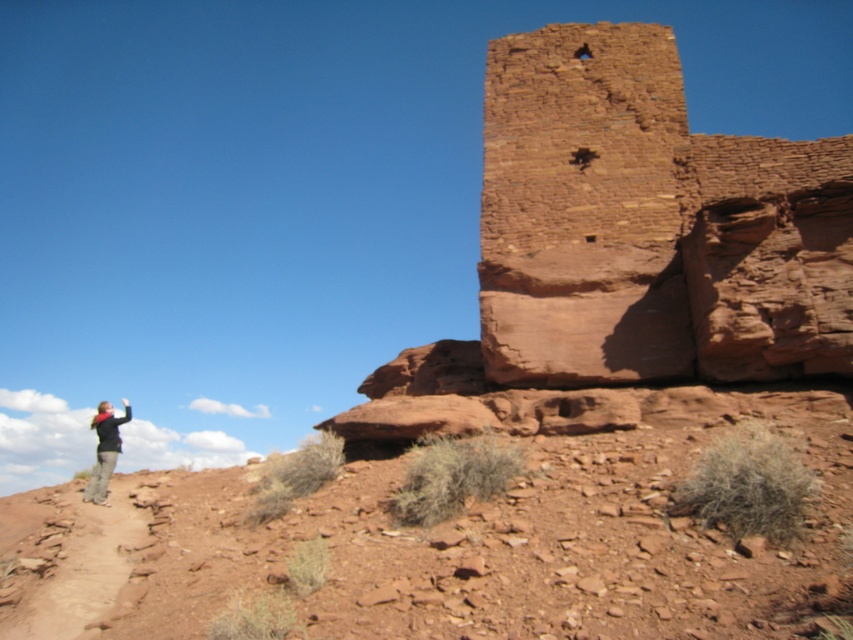
Can you confirm if reddish-brown rock at lower left is positioned below rustic stone ruins at upper right?

Yes, reddish-brown rock at lower left is below rustic stone ruins at upper right.

Between point (782, 404) and point (614, 64), which one is positioned in front?

Positioned in front is point (782, 404).

This screenshot has height=640, width=853. In order to click on reddish-brown rock at lower left in this screenshot , I will do `click(448, 545)`.

Describe the element at coordinates (648, 225) in the screenshot. I see `rustic stone ruins at upper right` at that location.

Find the location of a particular element. The height and width of the screenshot is (640, 853). rustic stone ruins at upper right is located at coordinates (648, 225).

Who is more distant from viewer, (662, 301) or (96, 468)?

Positioned behind is point (96, 468).

Find the location of a particular element. This screenshot has height=640, width=853. rustic stone ruins at upper right is located at coordinates (648, 225).

Who is taller, reddish-brown rock at lower left or blurred denim jacket at lower left?

blurred denim jacket at lower left is taller.

Is point (682, 534) in front of point (117, 422)?

That is True.

This screenshot has width=853, height=640. Identify the location of reddish-brown rock at lower left. (448, 545).